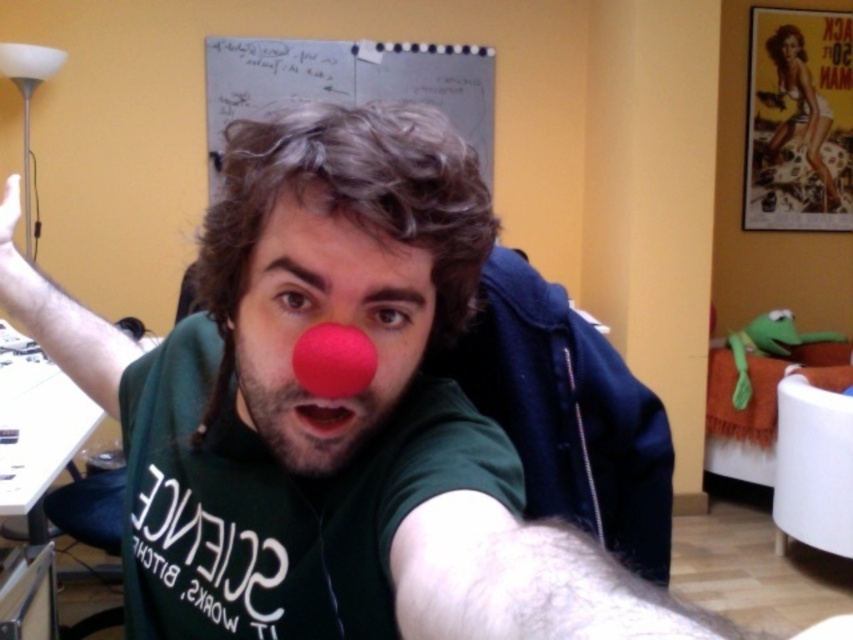
Is matte red nose at center positioned at the back of smooth matte red nose at center?

That is False.

Which of these two, matte red nose at center or smooth matte red nose at center, stands taller?

With more height is matte red nose at center.

Find the location of `matte red nose at center`. matte red nose at center is located at coordinates (325, 320).

Which is below, matte red nose at center or rubber-like red nose at center?

Positioned lower is rubber-like red nose at center.

Can you confirm if matte red nose at center is smaller than rubber-like red nose at center?

Actually, matte red nose at center might be larger than rubber-like red nose at center.

Who is more distant from viewer, (267,385) or (329,360)?

Positioned behind is point (267,385).

Where is `matte red nose at center`? matte red nose at center is located at coordinates (325, 320).

Is the position of rubber-like red nose at center less distant than that of smooth matte red nose at center?

→ Yes, rubber-like red nose at center is in front of smooth matte red nose at center.

Is rubber-like red nose at center below smooth matte red nose at center?

Incorrect, rubber-like red nose at center is not positioned below smooth matte red nose at center.

The height and width of the screenshot is (640, 853). Find the location of `rubber-like red nose at center`. rubber-like red nose at center is located at coordinates (334, 360).

The height and width of the screenshot is (640, 853). In order to click on rubber-like red nose at center in this screenshot , I will do `click(334, 360)`.